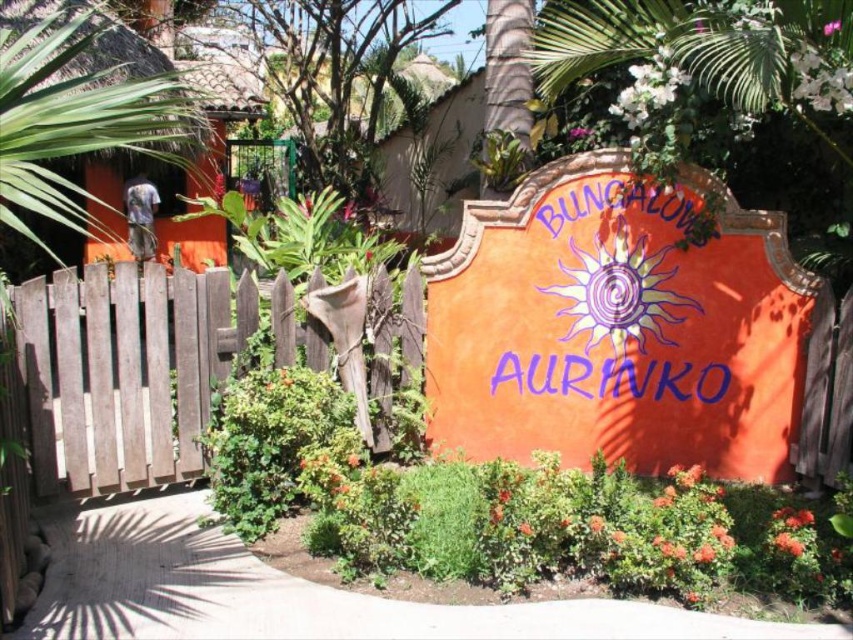
You are a landscape designer assessing the layout of the resort entrance. The purple painted sign at center and the pink matte flower at center are both in the foreground. Which object is wider?

The purple painted sign at center is wider than the pink matte flower at center, as its width surpasses the flower.